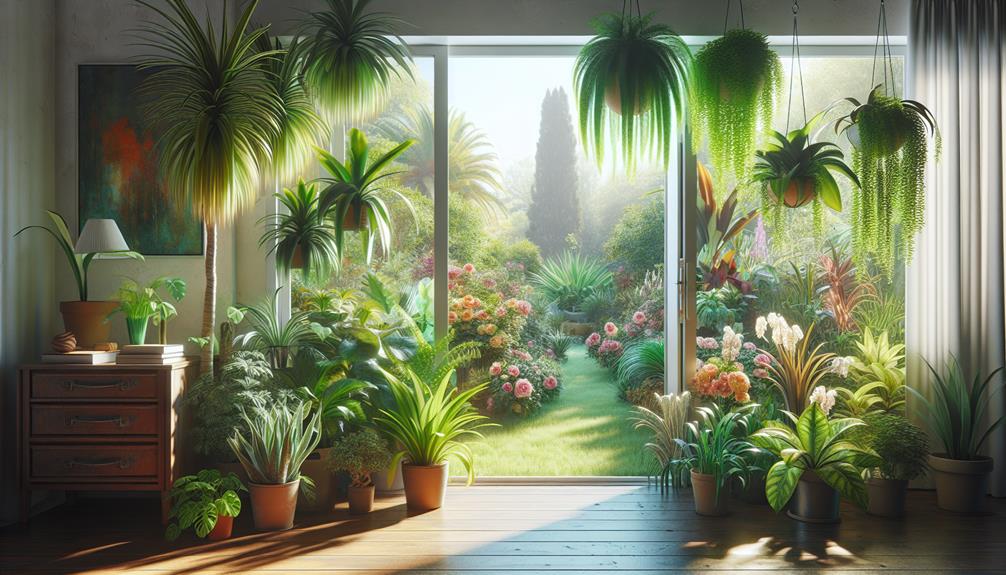
At what (x,y) coordinates should I click in order to perform the action: click on hanging plants. Please return your answer as a coordinate pair (x, y). The image size is (1006, 575). Looking at the image, I should click on (230, 118), (317, 63), (635, 44), (718, 69), (892, 125), (806, 168).